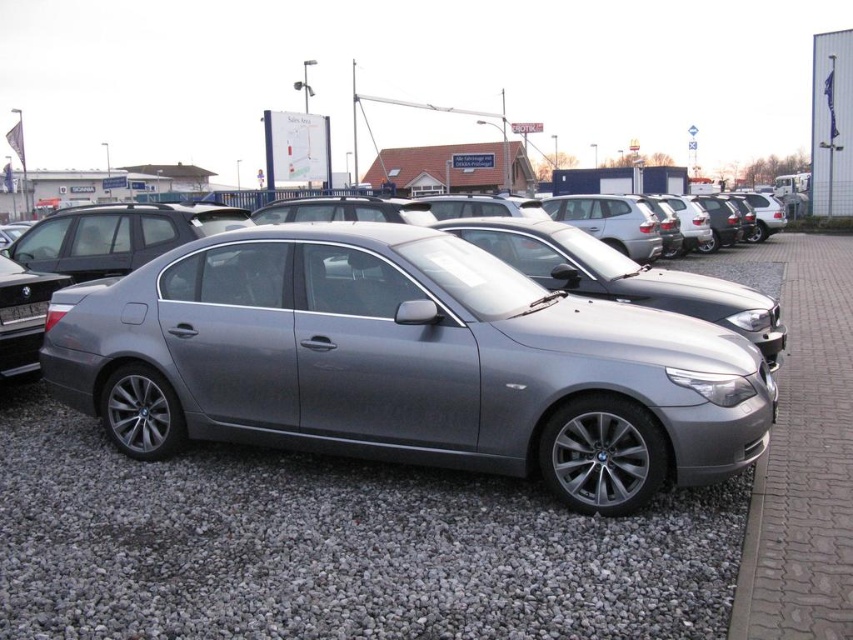
You are a delivery driver who needs to park your vehicle in this parking lot. The parking spot you want to use is located at coordinates point 0.569, 0.477. Is the satin metallic sedan at center currently occupying that spot?

The satin metallic sedan at center is positioned exactly at point (405, 364), so it is occupying the parking spot you want to use.